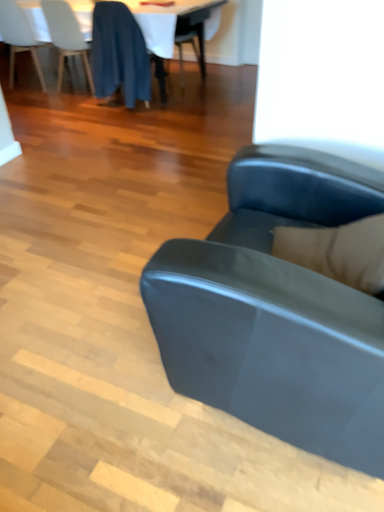
Where is `free space in front of white fabric table at upper center`? The image size is (384, 512). free space in front of white fabric table at upper center is located at coordinates (110, 132).